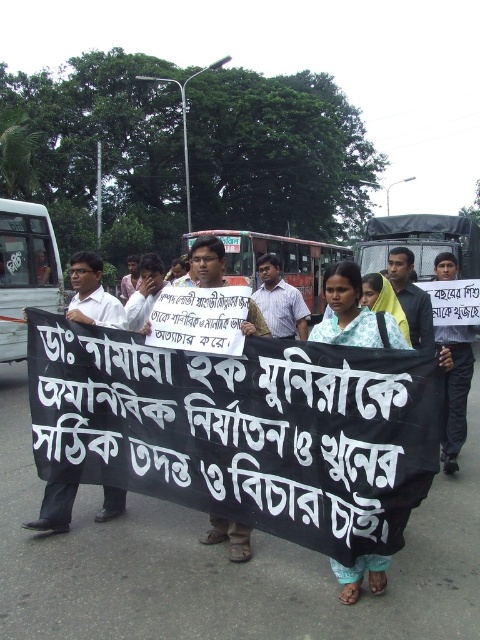
Is white cloth banner at center above white shirt at left?

No.

Between white cloth banner at center and white shirt at left, which one is positioned lower?

Positioned lower is white cloth banner at center.

This screenshot has width=480, height=640. What do you see at coordinates (244, 435) in the screenshot?
I see `white cloth banner at center` at bounding box center [244, 435].

Locate an element on the screen. This screenshot has width=480, height=640. white cloth banner at center is located at coordinates pyautogui.click(x=244, y=435).

Is white cloth banner at center taller than white cotton scarf at center?

Yes, white cloth banner at center is taller than white cotton scarf at center.

Is white cloth banner at center bigger than white cotton scarf at center?

Yes.

Between point (159, 458) and point (345, 316), which one is positioned behind?

Positioned behind is point (159, 458).

Find the location of a particular element. white cloth banner at center is located at coordinates (244, 435).

In the scene shown: Who is higher up, white paper sign at center or light brown shirt at center?

light brown shirt at center

Based on the photo, is white paper sign at center closer to camera compared to light brown shirt at center?

Yes, it is.

This screenshot has height=640, width=480. I want to click on white paper sign at center, so click(207, 260).